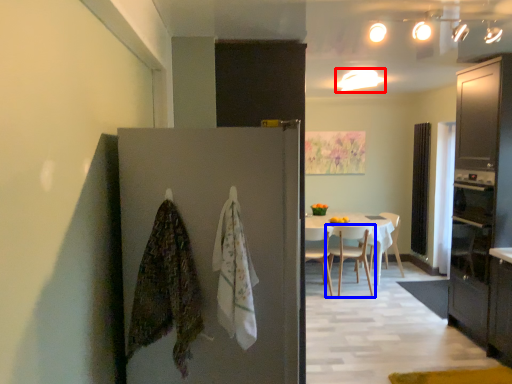
Question: Which of the following is the farthest to the observer, lighting (highlighted by a red box) or chair (highlighted by a blue box)?

Choices:
 (A) lighting
 (B) chair

Answer: (B)